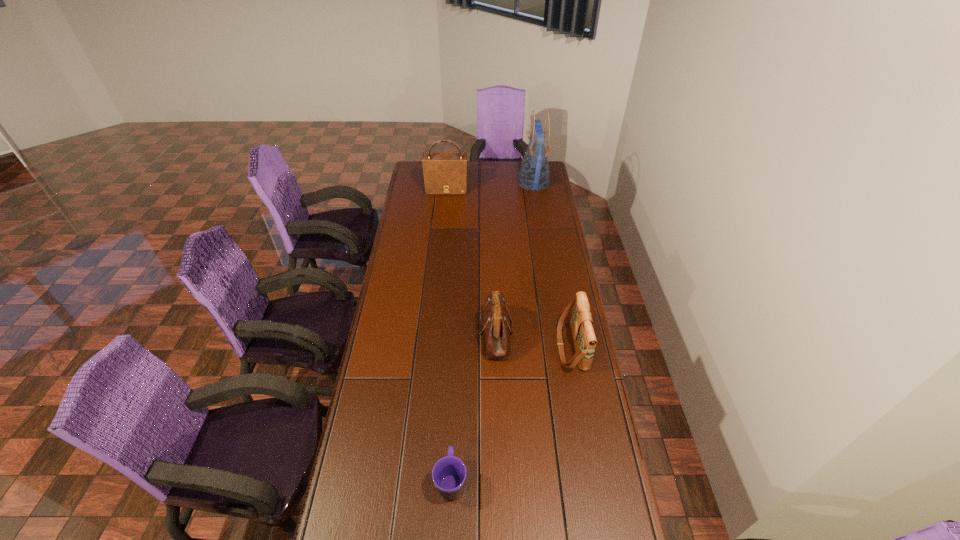
Locate an element on the screen. Image resolution: width=960 pixels, height=540 pixels. unoccupied area between the nearest object and the third object from left to right is located at coordinates (473, 407).

Where is `object that is the fourth closest to the farthest shoulder bag`? The width and height of the screenshot is (960, 540). object that is the fourth closest to the farthest shoulder bag is located at coordinates [449, 473].

Locate which object is the fourth closest to the rightmost shoulder bag. Please provide its 2D coordinates. Your answer should be formatted as a tuple, i.e. [(x, y)], where the tuple contains the x and y coordinates of a point satisfying the conditions above.

[(444, 173)]

This screenshot has width=960, height=540. I want to click on the closest shoulder bag to the fourth shortest object, so click(496, 325).

The width and height of the screenshot is (960, 540). In order to click on shoulder bag identified as the second closest to the rightmost shoulder bag in this screenshot , I will do `click(444, 173)`.

Identify the location of vacant area in the image that satisfies the following two spatial constraints: 1. with the handle on the side of the nearest object; 2. on the right side of the second shoulder bag from right to left. Image resolution: width=960 pixels, height=540 pixels. (458, 334).

The height and width of the screenshot is (540, 960). Identify the location of vacant space that satisfies the following two spatial constraints: 1. with the handle on the side of the third object from right to left; 2. on the left side of the nearest object. (458, 334).